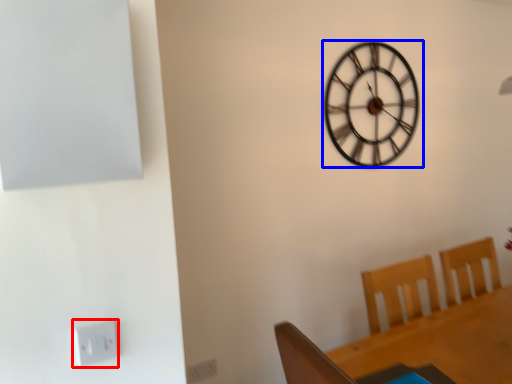
Question: Which object is further to the camera taking this photo, electric outlet (highlighted by a red box) or wall clock (highlighted by a blue box)?

Choices:
 (A) electric outlet
 (B) wall clock

Answer: (B)